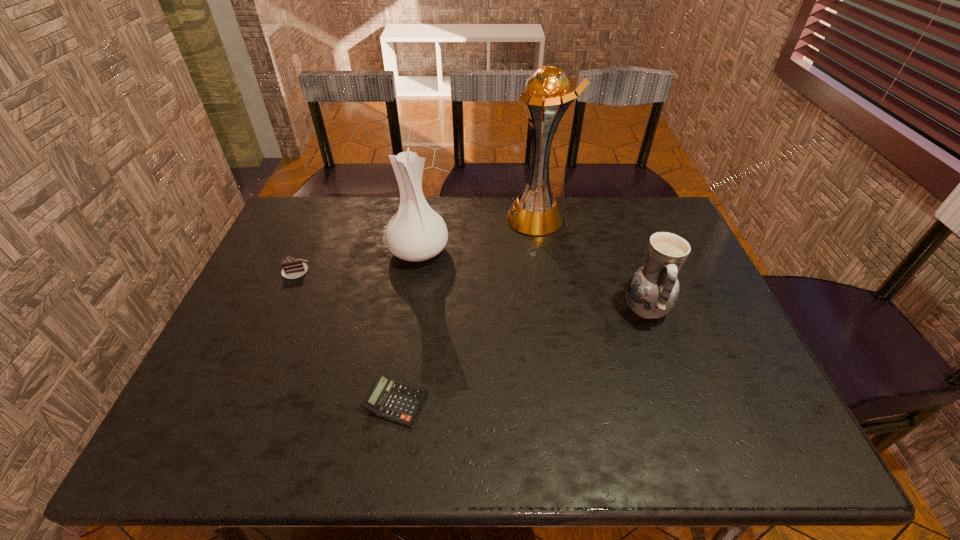
Identify the location of trophy. (535, 212).

Where is `the second object from right to left`? the second object from right to left is located at coordinates [x=535, y=212].

Identify the location of the second tallest object. Image resolution: width=960 pixels, height=540 pixels. (416, 232).

Locate an element on the screen. The width and height of the screenshot is (960, 540). the third tallest object is located at coordinates (652, 291).

You are a GUI agent. You are given a task and a screenshot of the screen. Output one action in this format:
    pyautogui.click(x=<x>, y=<y>)
    Task: Click on the second nearest object
    Image resolution: width=960 pixels, height=540 pixels.
    Given the screenshot: What is the action you would take?
    pyautogui.click(x=652, y=291)

The image size is (960, 540). Find the location of `the second shortest object`. the second shortest object is located at coordinates (293, 268).

Where is `the leftmost object`? Image resolution: width=960 pixels, height=540 pixels. the leftmost object is located at coordinates (293, 268).

Find the location of `the shortest object`. the shortest object is located at coordinates (391, 399).

I want to click on the nearest object, so click(391, 399).

Locate an element on the screen. The image size is (960, 540). vacant region located 0.360m on the front-facing side of the trophy is located at coordinates (400, 218).